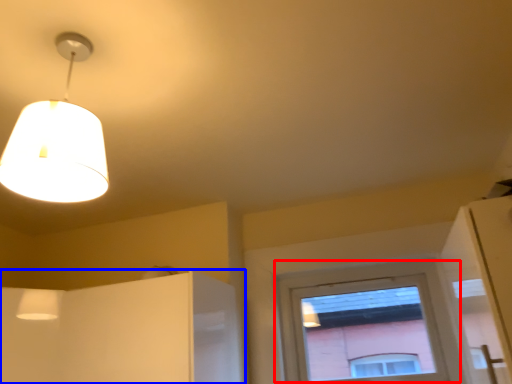
Question: Which of the following is the closest to the observer, window (highlighted by a red box) or cabinetry (highlighted by a blue box)?

Choices:
 (A) window
 (B) cabinetry

Answer: (B)